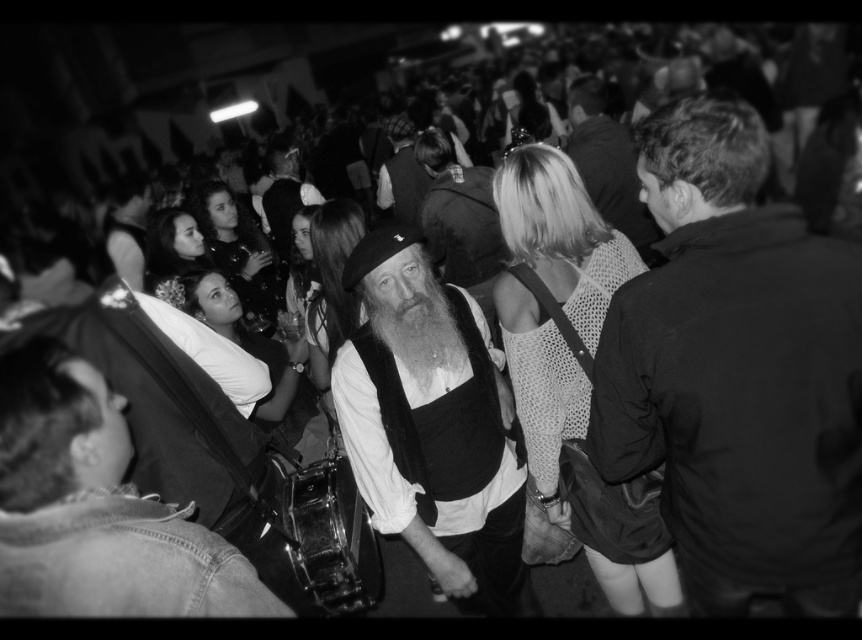
Between dark fabric jacket at center and smooth leather jacket at upper center, which one is positioned lower?

dark fabric jacket at center is lower down.

Which is more to the right, dark fabric jacket at center or smooth leather jacket at upper center?

smooth leather jacket at upper center

Who is more forward, [835,518] or [656,234]?

Positioned in front is point [835,518].

Where is `dark fabric jacket at center`? The width and height of the screenshot is (862, 640). dark fabric jacket at center is located at coordinates (736, 372).

Which is more to the left, denim jacket at lower left or smooth leather jacket at upper center?

From the viewer's perspective, denim jacket at lower left appears more on the left side.

Between point (102, 428) and point (566, 97), which one is positioned behind?

The point (566, 97) is behind.

What do you see at coordinates (97, 509) in the screenshot?
I see `denim jacket at lower left` at bounding box center [97, 509].

Find the location of `denim jacket at lower left`. denim jacket at lower left is located at coordinates (97, 509).

Who is positioned more to the left, dark fabric jacket at center or smooth leather jacket at center?

smooth leather jacket at center is more to the left.

Who is more distant from viewer, (731, 368) or (409, 138)?

Positioned behind is point (409, 138).

Between point (829, 275) and point (413, 154), which one is positioned in front?

Point (829, 275) is more forward.

Locate an element on the screen. This screenshot has width=862, height=640. dark fabric jacket at center is located at coordinates (736, 372).